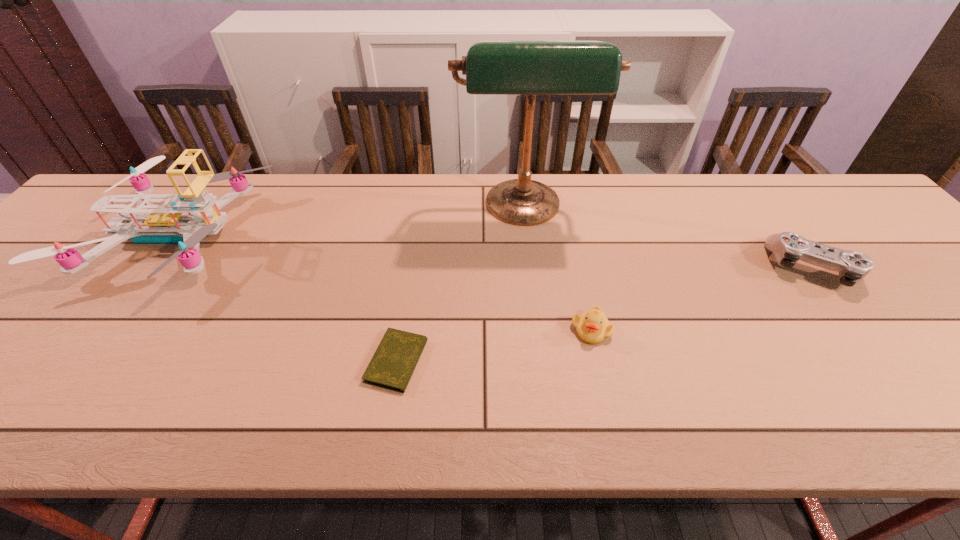
Identify the location of free region located on the front-facing side of the duckling. This screenshot has width=960, height=540. (613, 433).

The image size is (960, 540). What are the coordinates of `vacant space located on the right of the shortest object` in the screenshot? It's located at (510, 361).

Locate an element on the screen. This screenshot has height=540, width=960. table lamp that is at the far edge is located at coordinates (530, 68).

At what (x,y) coordinates should I click in order to perform the action: click on drone situated at the far edge. Please return your answer as a coordinate pair (x, y). Image resolution: width=960 pixels, height=540 pixels. Looking at the image, I should click on (184, 223).

This screenshot has width=960, height=540. Identify the location of object that is at the near edge. (392, 365).

Locate an element on the screen. object located in the left edge section of the desktop is located at coordinates (184, 223).

What are the coordinates of `object at the far left corner` in the screenshot? It's located at (184, 223).

Find the location of `free space at the far edge of the desktop`. free space at the far edge of the desktop is located at coordinates (781, 222).

In the image, there is a desktop. Find the location of `blank space at the near edge`. blank space at the near edge is located at coordinates (661, 390).

This screenshot has height=540, width=960. What are the coordinates of `vacant region at the far right corner of the desktop` in the screenshot? It's located at (830, 208).